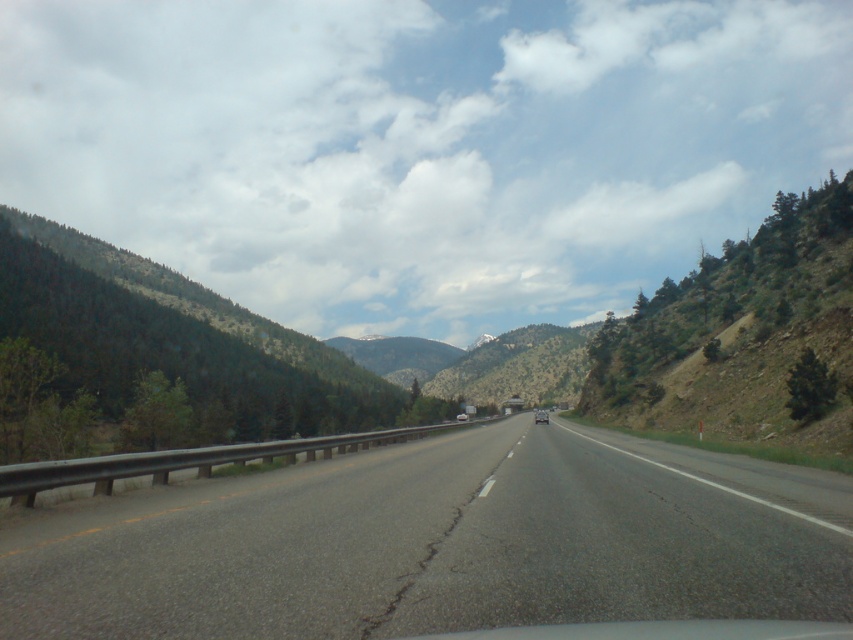
How distant is asphalt road at center from white glossy car at center?

asphalt road at center and white glossy car at center are 301.50 feet apart.

What do you see at coordinates (438, 545) in the screenshot?
I see `asphalt road at center` at bounding box center [438, 545].

This screenshot has width=853, height=640. Identify the location of asphalt road at center. tap(438, 545).

Can you confirm if asphalt road at center is positioned below metallic silver car at center?

No.

Who is positioned more to the right, asphalt road at center or metallic silver car at center?

metallic silver car at center is more to the right.

Is point (440, 458) positioned behind point (538, 410)?

No, it is not.

This screenshot has width=853, height=640. In order to click on asphalt road at center in this screenshot , I will do 438,545.

Does metallic silver car at center appear on the right side of white glossy car at center?

Indeed, metallic silver car at center is positioned on the right side of white glossy car at center.

Is metallic silver car at center taller than white glossy car at center?

Correct, metallic silver car at center is much taller as white glossy car at center.

Does point (537, 412) lie in front of point (456, 419)?

No.

You are a GUI agent. You are given a task and a screenshot of the screen. Output one action in this format:
    pyautogui.click(x=<x>, y=<y>)
    Task: Click on the metallic silver car at center
    The image size is (853, 640).
    Given the screenshot: What is the action you would take?
    pyautogui.click(x=541, y=417)